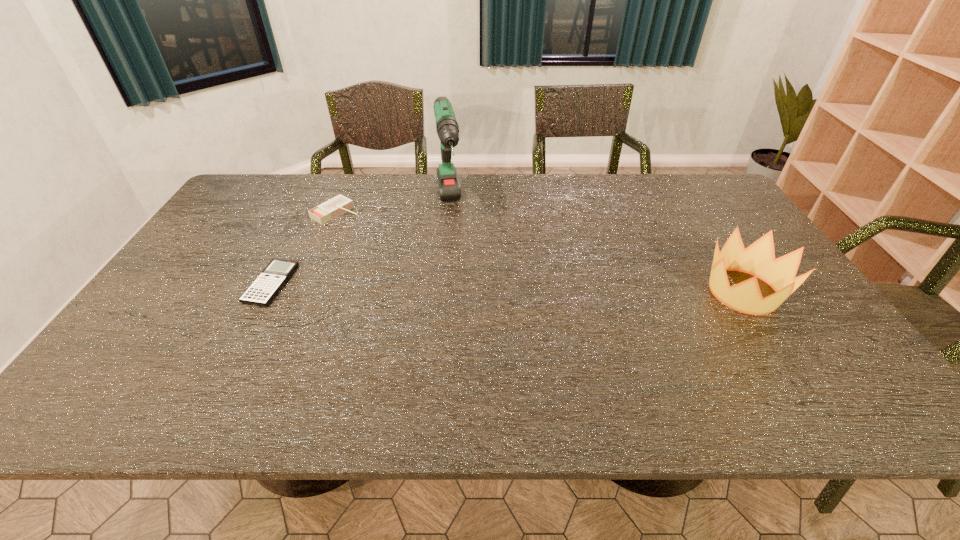
In the image, there is a desktop. Identify the location of vacant space at the right edge. click(x=794, y=305).

Image resolution: width=960 pixels, height=540 pixels. What are the coordinates of `free space at the far left corner of the desktop` in the screenshot? It's located at [x=270, y=207].

In the image, there is a desktop. Find the location of `vacant area at the far right corner`. vacant area at the far right corner is located at coordinates (700, 202).

The width and height of the screenshot is (960, 540). Find the location of `vacant area that lies between the rightmost object and the matchbox`. vacant area that lies between the rightmost object and the matchbox is located at coordinates (540, 252).

Find the location of a particular element. The image size is (960, 540). vacant region between the rightmost object and the drill is located at coordinates (595, 248).

Identify the location of vacant point located between the calculator and the rightmost object. (507, 288).

At what (x,y) coordinates should I click in order to perform the action: click on empty space that is in between the second object from right to left and the matchbox. Please return your answer as a coordinate pair (x, y). The image size is (960, 540). Looking at the image, I should click on (392, 208).

You are a GUI agent. You are given a task and a screenshot of the screen. Output one action in this format:
    pyautogui.click(x=<x>, y=<y>)
    Task: Click on the vacant region between the tallest object and the second shortest object
    The height and width of the screenshot is (540, 960).
    Given the screenshot: What is the action you would take?
    pyautogui.click(x=392, y=208)

Image resolution: width=960 pixels, height=540 pixels. Find the location of `empty location between the second object from right to left and the crown`. empty location between the second object from right to left and the crown is located at coordinates (595, 248).

Find the location of a particular element. Image resolution: width=960 pixels, height=540 pixels. unoccupied area between the matchbox and the third shortest object is located at coordinates (540, 252).